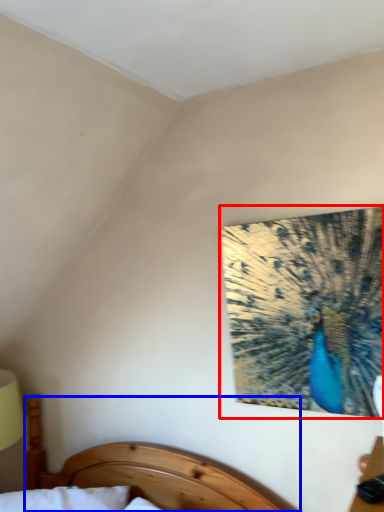
Question: Which object appears farthest to the camera in this image, peacock (highlighted by a red box) or bed (highlighted by a blue box)?

Choices:
 (A) peacock
 (B) bed

Answer: (A)